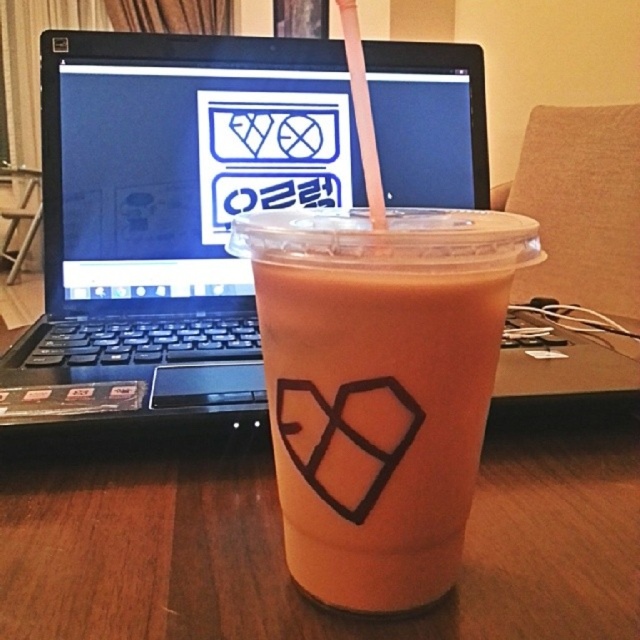
Does black plastic laptop at center have a larger size compared to translucent plastic cup at center?

Indeed, black plastic laptop at center has a larger size compared to translucent plastic cup at center.

Which is in front, point (44, 214) or point (257, 276)?

Point (257, 276) is more forward.

Where is `black plastic laptop at center`? This screenshot has height=640, width=640. black plastic laptop at center is located at coordinates (170, 216).

Is point (481, 365) positioned after point (376, 164)?

No, it is in front of (376, 164).

Which is below, translucent plastic cup at center or transparent plastic straw at upper center?

Positioned lower is translucent plastic cup at center.

At what (x,y) coordinates should I click in order to perform the action: click on translucent plastic cup at center. Please return your answer as a coordinate pair (x, y). The height and width of the screenshot is (640, 640). Looking at the image, I should click on (380, 387).

Where is `black plastic laptop at center`? black plastic laptop at center is located at coordinates (170, 216).

Between black plastic laptop at center and transparent plastic straw at upper center, which one is positioned lower?

black plastic laptop at center

The width and height of the screenshot is (640, 640). I want to click on black plastic laptop at center, so pyautogui.click(x=170, y=216).